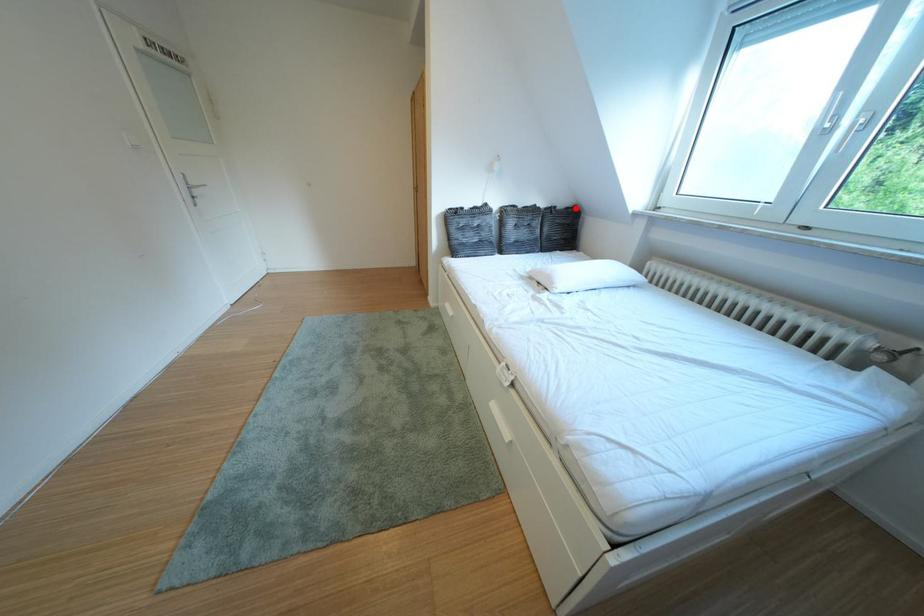
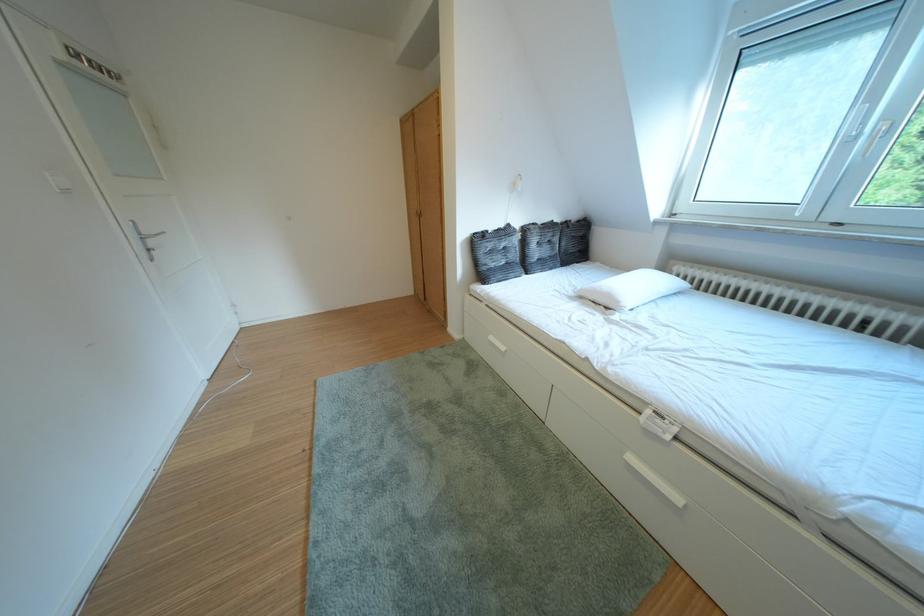
Find the pixel in the second image that matches the highlighted location in the first image.

(588, 222)